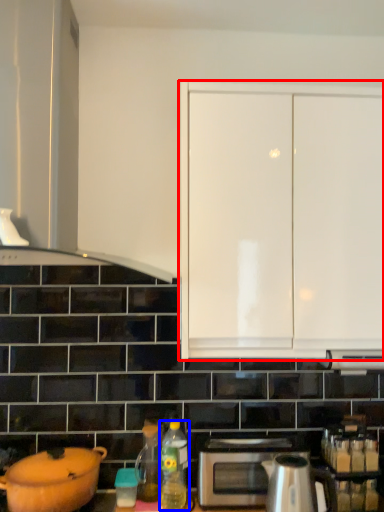
Question: Which of the following is the closest to the observer, cabinetry (highlighted by a red box) or bottle (highlighted by a blue box)?

Choices:
 (A) cabinetry
 (B) bottle

Answer: (A)